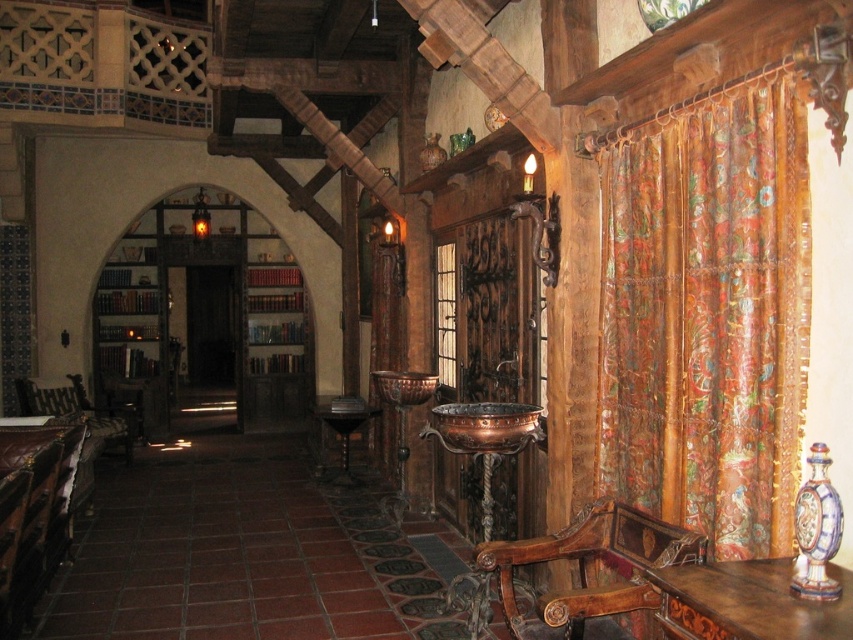
Question: Which of the following is the farthest from the observer?

Choices:
 (A) (74, 397)
 (B) (688, 132)

Answer: (A)

Question: Which of the following is the farthest from the observer?

Choices:
 (A) (28, 384)
 (B) (337, 477)

Answer: (A)

Question: Which object is positioned farthest from the copper/bronze sink at center?

Choices:
 (A) leather cushioned chair at center
 (B) wooden table at center
 (C) brown polished wood table at lower right
 (D) polished wood chair at center

Answer: (A)

Question: Can you confirm if copper/bronze sink at center is positioned to the right of leather cushioned chair at center?

Choices:
 (A) no
 (B) yes

Answer: (B)

Question: Can you confirm if floral silk curtain at right is wider than brown polished wood table at lower right?

Choices:
 (A) no
 (B) yes

Answer: (A)

Question: Does floral silk curtain at right have a smaller size compared to copper/bronze sink at center?

Choices:
 (A) no
 (B) yes

Answer: (A)